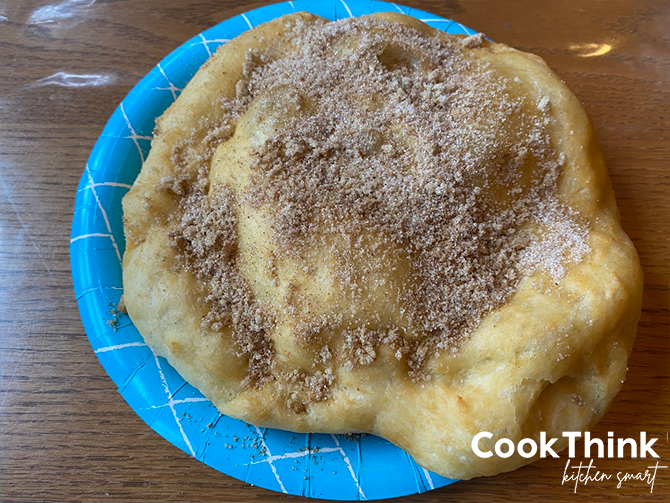
Identify the location of wooden table. The image size is (670, 503). (42, 407).